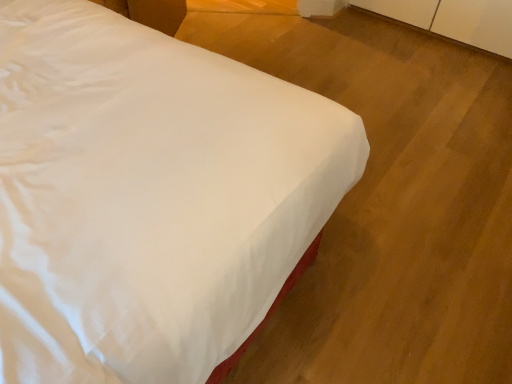
You are a GUI agent. You are given a task and a screenshot of the screen. Output one action in this format:
    pyautogui.click(x=<x>, y=<y>)
    Task: Click on the white satin bed at upper left
    The image size is (512, 384).
    Given the screenshot: What is the action you would take?
    pyautogui.click(x=149, y=196)

What do you see at coordinates (149, 196) in the screenshot? I see `white satin bed at upper left` at bounding box center [149, 196].

The image size is (512, 384). I want to click on white satin bed at upper left, so click(149, 196).